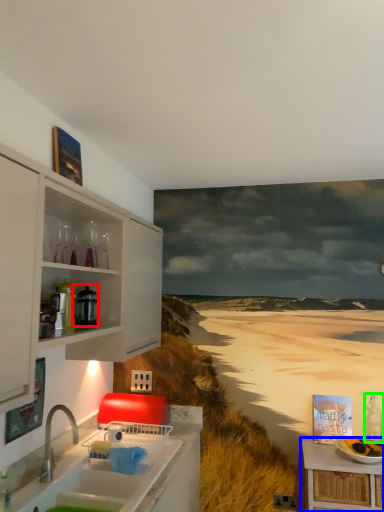
Question: Estimate the real-world distances between objects in this image. Which object is closer to appliance (highlighted by a red box), table (highlighted by a blue box) or bottle (highlighted by a green box)?

Choices:
 (A) table
 (B) bottle

Answer: (A)